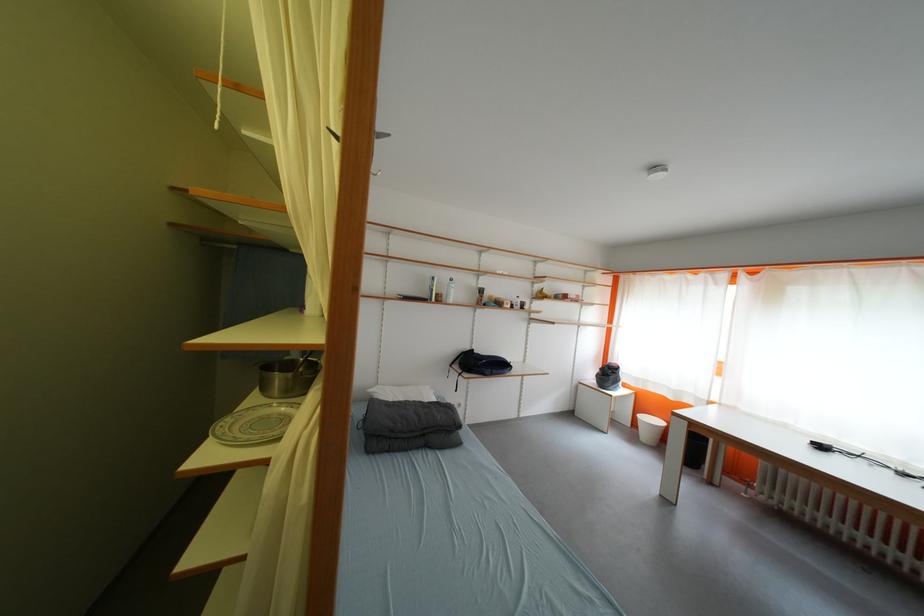
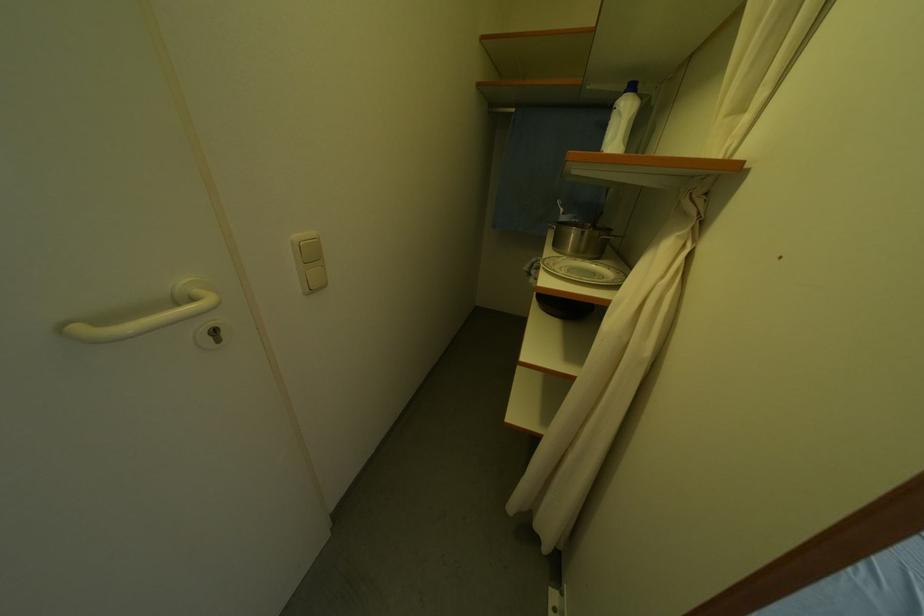
In the second image, find the point that corresponds to (229,427) in the first image.

(554, 265)